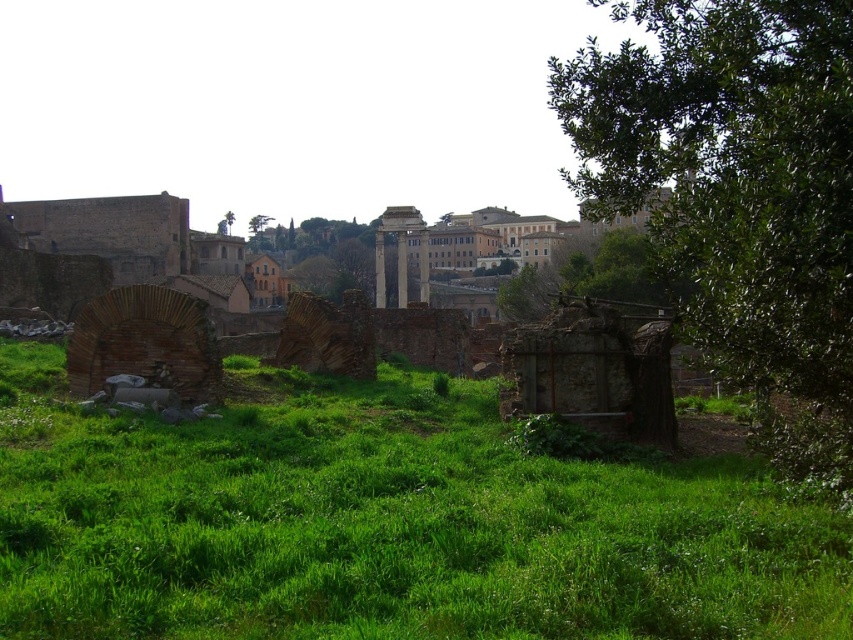
Which of these two, green leafy tree at right or green leafy tree at upper center, stands shorter?

green leafy tree at right

Is point (729, 35) less distant than point (268, 220)?

Yes, it is in front of point (268, 220).

Is point (842, 0) behind point (248, 228)?

No, (842, 0) is closer to viewer.

Find the location of a particular element. This screenshot has height=640, width=853. green leafy tree at right is located at coordinates pos(738,195).

This screenshot has height=640, width=853. I want to click on green grassy at center, so click(x=386, y=524).

Measure the distance between green grassy at center and camera.

green grassy at center and camera are 29.10 meters apart from each other.

Between point (403, 481) and point (260, 234), which one is positioned behind?

Positioned behind is point (260, 234).

Image resolution: width=853 pixels, height=640 pixels. Find the location of `green grassy at center`. green grassy at center is located at coordinates (386, 524).

Can you confirm if green grassy at center is bigger than green leafy tree at right?

No.

Is the position of green grassy at center more distant than that of green leafy tree at right?

No, green grassy at center is in front of green leafy tree at right.

This screenshot has height=640, width=853. Identify the location of green grassy at center. (386, 524).